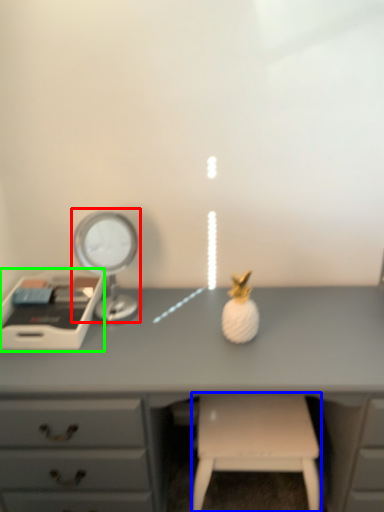
Question: Considering the real-world distances, which object is closest to bedside lamp (highlighted by a red box)? stool (highlighted by a blue box) or writing desk (highlighted by a green box).

Choices:
 (A) stool
 (B) writing desk

Answer: (B)